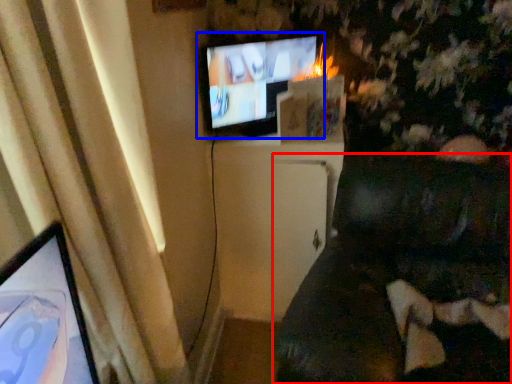
Question: Which object is further to the camera taking this photo, furniture (highlighted by a red box) or television (highlighted by a blue box)?

Choices:
 (A) furniture
 (B) television

Answer: (B)